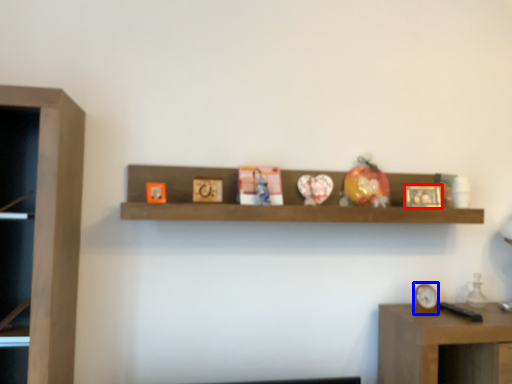
Question: Which object appears farthest to the camera in this image, picture frame (highlighted by a red box) or clock (highlighted by a blue box)?

Choices:
 (A) picture frame
 (B) clock

Answer: (A)